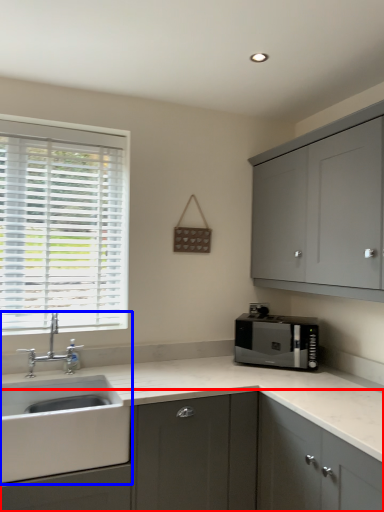
Question: Among these objects, which one is farthest to the camera, cabinetry (highlighted by a red box) or sink (highlighted by a blue box)?

Choices:
 (A) cabinetry
 (B) sink

Answer: (B)